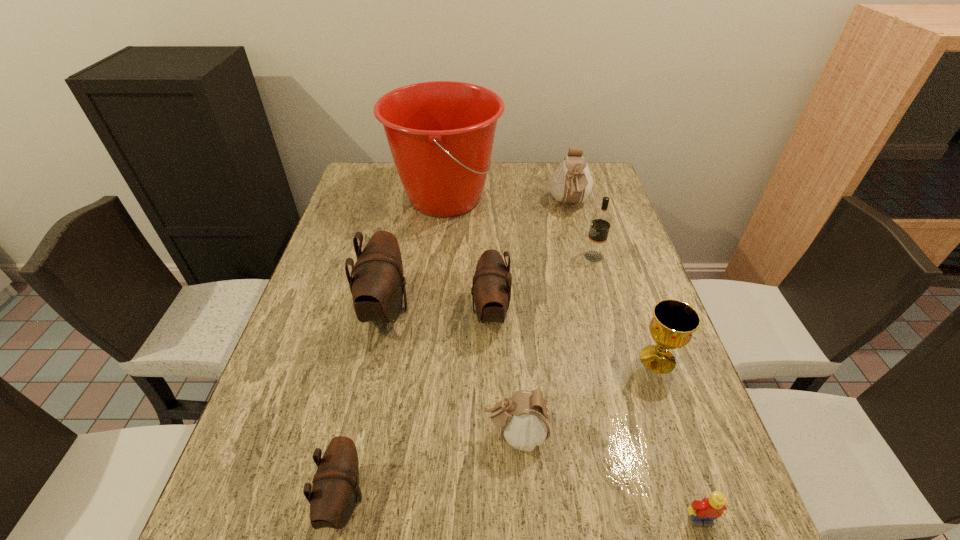
Identify the location of red bucket. (441, 133).

Identify the location of bucket. (441, 133).

Image resolution: width=960 pixels, height=540 pixels. Identify the location of the biggest brown pouch. (378, 284).

The image size is (960, 540). I want to click on the seventh nearest object, so click(594, 251).

This screenshot has height=540, width=960. I want to click on the farther white pouch, so click(x=571, y=182).

Where is `the bigger white pouch`? The image size is (960, 540). the bigger white pouch is located at coordinates (571, 182).

You are a GUI agent. You are given a task and a screenshot of the screen. Output one action in this format:
    pyautogui.click(x=<x>, y=<y>)
    Task: Click on the rightmost brown pouch
    This screenshot has height=540, width=960.
    Given the screenshot: What is the action you would take?
    pyautogui.click(x=491, y=288)

Image resolution: width=960 pixels, height=540 pixels. I want to click on gold chalice, so click(x=673, y=323).

Image resolution: width=960 pixels, height=540 pixels. I want to click on the second nearest pouch, so click(524, 421).

The height and width of the screenshot is (540, 960). Identify the location of the nearer white pouch. (524, 421).